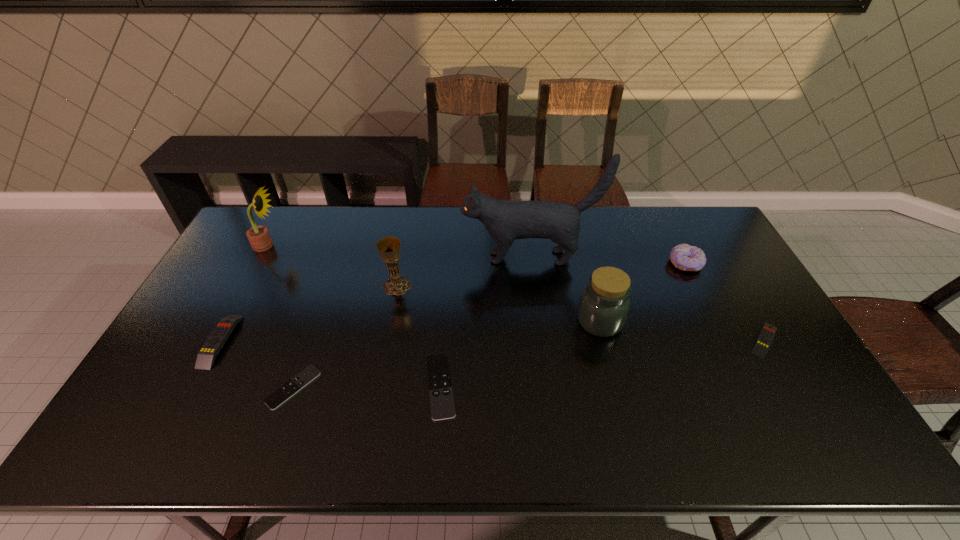
Where is `gray cat`? The width and height of the screenshot is (960, 540). gray cat is located at coordinates (505, 221).

Image resolution: width=960 pixels, height=540 pixels. Find the location of `cat`. cat is located at coordinates (505, 221).

You are a GUI agent. You are given a task and a screenshot of the screen. Output one action in this format:
    pyautogui.click(x=<x>, y=<y>)
    Task: Click on the sunflower
    The width and height of the screenshot is (960, 540).
    Given the screenshot: What is the action you would take?
    pyautogui.click(x=258, y=236)

Where is `the eighth shortest object`? the eighth shortest object is located at coordinates (258, 236).

The width and height of the screenshot is (960, 540). I want to click on chalice, so click(389, 247).

This screenshot has height=540, width=960. Find the location of `the sixth object from right to left`. the sixth object from right to left is located at coordinates (389, 247).

This screenshot has height=540, width=960. Find the location of `jar`. jar is located at coordinates (604, 305).

Locate an element on the screen. This screenshot has width=960, height=540. doughnut is located at coordinates (683, 256).

Locate an element on the screen. The width and height of the screenshot is (960, 540). the fifth shortest object is located at coordinates (683, 256).

Where is `the tallest remote control`? The image size is (960, 540). the tallest remote control is located at coordinates (206, 356).